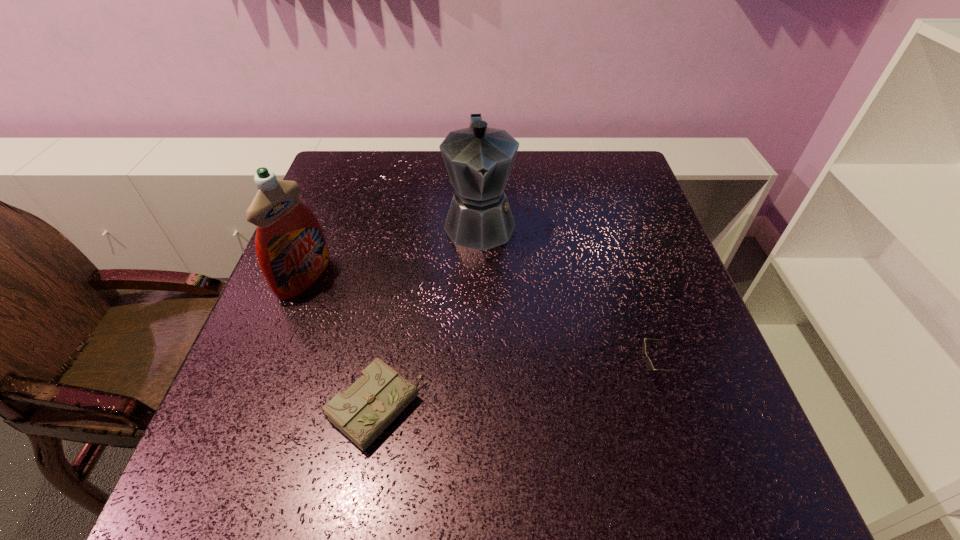
Locate which object is the third closest to the shortest object. Please provide its 2D coordinates. Your answer should be formatted as a tuple, i.e. [(x, y)], where the tuple contains the x and y coordinates of a point satisfying the conditions above.

[(649, 365)]

Point out which object is positioned as the second nearest to the shortest object. Please provide its 2D coordinates. Your answer should be formatted as a tuple, i.e. [(x, y)], where the tuple contains the x and y coordinates of a point satisfying the conditions above.

[(478, 159)]

Where is `vacant space that satisfies the following two spatial constraints: 1. on the back side of the shortest object; 2. in front of the lenses of the sunglasses`? vacant space that satisfies the following two spatial constraints: 1. on the back side of the shortest object; 2. in front of the lenses of the sunglasses is located at coordinates (383, 372).

Where is `free space that satisfies the following two spatial constraints: 1. on the front side of the detergent; 2. in front of the lenses of the third tallest object`? free space that satisfies the following two spatial constraints: 1. on the front side of the detergent; 2. in front of the lenses of the third tallest object is located at coordinates (269, 372).

The height and width of the screenshot is (540, 960). In order to click on free space in the image that satisfies the following two spatial constraints: 1. on the front side of the detergent; 2. in front of the lenses of the sunglasses in this screenshot , I will do `click(269, 372)`.